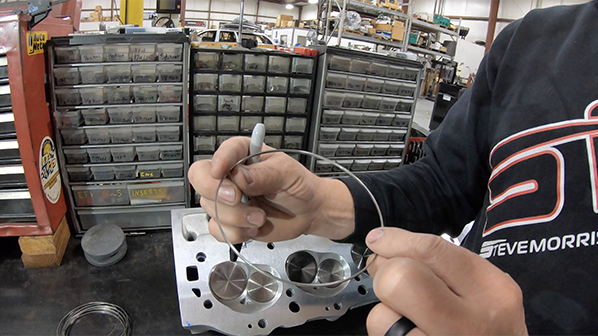
The height and width of the screenshot is (336, 598). In order to click on part shelf in this screenshot , I will do `click(129, 88)`.